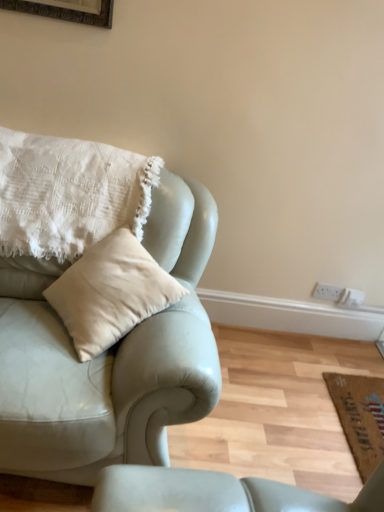
The image size is (384, 512). I want to click on matte leather couch at left, so click(118, 342).

From the image's perspective, is brown woven mat at lower right located above matte leather couch at left?

Incorrect, from the image's perspective, brown woven mat at lower right is lower than matte leather couch at left.

Choose the correct answer: Is brown woven mat at lower right inside matte leather couch at left or outside it?

brown woven mat at lower right is outside matte leather couch at left.

Considering the relative positions of brown woven mat at lower right and matte leather couch at left in the image provided, is brown woven mat at lower right to the left of matte leather couch at left from the viewer's perspective?

No, brown woven mat at lower right is not to the left of matte leather couch at left.

Is brown woven mat at lower right wider than matte leather couch at left?

Incorrect, the width of brown woven mat at lower right does not surpass that of matte leather couch at left.

How distant is white textured pillow at upper left from brown woven mat at lower right?

They are 4.45 feet apart.

Does white textured pillow at upper left have a lesser width compared to brown woven mat at lower right?

Incorrect, the width of white textured pillow at upper left is not less than that of brown woven mat at lower right.

Considering the positions of objects white textured pillow at upper left and brown woven mat at lower right in the image provided, who is behind, white textured pillow at upper left or brown woven mat at lower right?

brown woven mat at lower right is more distant.

Is white textured pillow at upper left far away from brown woven mat at lower right?

That's right, there is a large distance between white textured pillow at upper left and brown woven mat at lower right.

Is matte leather couch at left outside of brown woven mat at lower right?

matte leather couch at left lies outside brown woven mat at lower right's area.

Considering the sizes of matte leather couch at left and brown woven mat at lower right in the image, is matte leather couch at left wider or thinner than brown woven mat at lower right?

Clearly, matte leather couch at left has more width compared to brown woven mat at lower right.

Is matte leather couch at left closer to the viewer compared to brown woven mat at lower right?

Yes, matte leather couch at left is in front of brown woven mat at lower right.

From the image's perspective, is matte leather couch at left located above white textured pillow at upper left?

Incorrect, from the image's perspective, matte leather couch at left is lower than white textured pillow at upper left.

Which point is more forward, (x=47, y=173) or (x=8, y=150)?

Point (x=47, y=173)

Considering the sizes of objects matte leather couch at left and white textured pillow at upper left in the image provided, who is thinner, matte leather couch at left or white textured pillow at upper left?

Thinner between the two is white textured pillow at upper left.

Can you tell me how much matte leather couch at left and white textured pillow at upper left differ in facing direction?

matte leather couch at left and white textured pillow at upper left are facing 0.529 degrees away from each other.

In the scene shown: Does brown woven mat at lower right come in front of white textured pillow at upper left?

No, it is not.

Looking at this image, from the image's perspective, is brown woven mat at lower right under white textured pillow at upper left?

Indeed, from the image's perspective, brown woven mat at lower right is shown beneath white textured pillow at upper left.

Can you confirm if brown woven mat at lower right is smaller than white textured pillow at upper left?

Correct, brown woven mat at lower right occupies less space than white textured pillow at upper left.

Considering the relative sizes of brown woven mat at lower right and white textured pillow at upper left in the image provided, is brown woven mat at lower right shorter than white textured pillow at upper left?

Yes.

From a real-world perspective, who is located lower, white textured pillow at upper left or matte leather couch at left?

matte leather couch at left.

Is white textured pillow at upper left smaller than matte leather couch at left?

Yes, white textured pillow at upper left is smaller than matte leather couch at left.

Considering the positions of points (67, 143) and (120, 456), is point (67, 143) closer to camera compared to point (120, 456)?

That is False.

Locate an element on the screen. Image resolution: width=384 pixels, height=512 pixels. mat that is under the matte leather couch at left (from a real-world perspective) is located at coordinates (360, 417).

You are a GUI agent. You are given a task and a screenshot of the screen. Output one action in this format:
    pyautogui.click(x=<x>, y=<y>)
    Task: Click on the mat behind the white textured pillow at upper left
    The width and height of the screenshot is (384, 512).
    Given the screenshot: What is the action you would take?
    pyautogui.click(x=360, y=417)

Which object lies nearer to the anchor point matte leather couch at left, white textured pillow at upper left or brown woven mat at lower right?

white textured pillow at upper left.

When comparing their distances from brown woven mat at lower right, does matte leather couch at left or white textured pillow at upper left seem closer?

matte leather couch at left is closer to brown woven mat at lower right.

Which object lies further to the anchor point matte leather couch at left, brown woven mat at lower right or white textured pillow at upper left?

The object further to matte leather couch at left is brown woven mat at lower right.

When comparing their distances from white textured pillow at upper left, does brown woven mat at lower right or matte leather couch at left seem further?

brown woven mat at lower right is positioned further to the anchor white textured pillow at upper left.

Estimate the real-world distances between objects in this image. Which object is closer to white textured pillow at upper left, matte leather couch at left or brown woven mat at lower right?

matte leather couch at left lies closer to white textured pillow at upper left than the other object.

When comparing their distances from brown woven mat at lower right, does white textured pillow at upper left or matte leather couch at left seem closer?

Among the two, matte leather couch at left is located nearer to brown woven mat at lower right.

The width and height of the screenshot is (384, 512). Identify the location of studio couch between white textured pillow at upper left and brown woven mat at lower right. (118, 342).